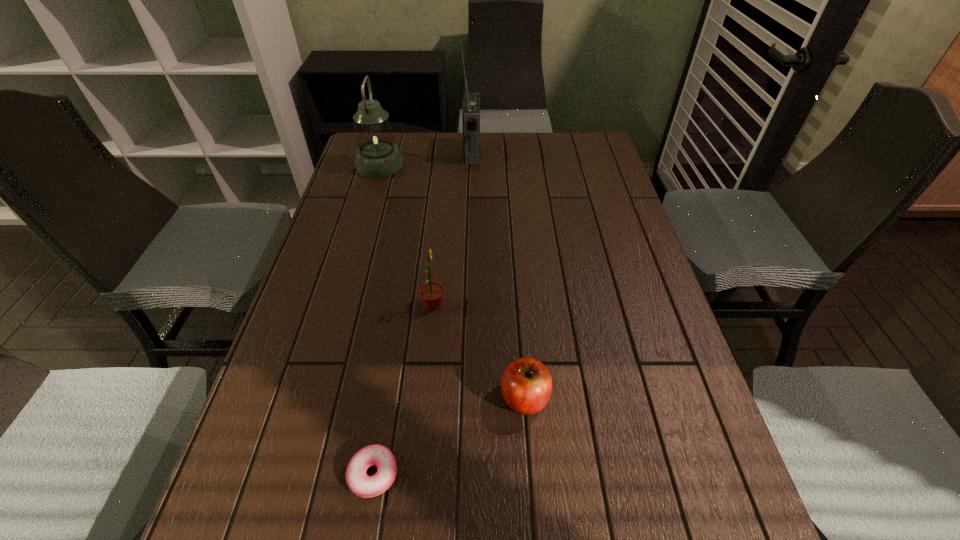
Locate an element on the screen. vacant space that satisfies the following two spatial constraints: 1. on the face of the third tallest object; 2. on the right side of the apple is located at coordinates (424, 398).

I want to click on vacant space that satisfies the following two spatial constraints: 1. on the back side of the fourth tallest object; 2. on the face of the third object from left to right, so click(x=517, y=305).

Locate an element on the screen. The height and width of the screenshot is (540, 960). vacant point that satisfies the following two spatial constraints: 1. on the back side of the apple; 2. on the display of the tallest object is located at coordinates (506, 152).